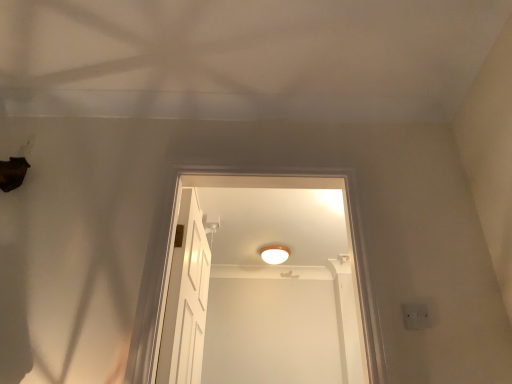
Question: From their relative heights in the image, would you say white wooden door at center is taller or shorter than white matte light fixture at center?

Choices:
 (A) tall
 (B) short

Answer: (A)

Question: Does point (199, 317) appear closer or farther from the camera than point (274, 259)?

Choices:
 (A) closer
 (B) farther

Answer: (A)

Question: From a real-world perspective, relative to white matte light fixture at center, is white wooden door at center vertically above or below?

Choices:
 (A) below
 (B) above

Answer: (A)

Question: Is white matte light fixture at center situated inside white wooden door at center or outside?

Choices:
 (A) inside
 (B) outside

Answer: (B)

Question: Is white matte light fixture at center in front of or behind white wooden door at center in the image?

Choices:
 (A) front
 (B) behind

Answer: (B)

Question: From a real-world perspective, is white matte light fixture at center positioned above or below white wooden door at center?

Choices:
 (A) below
 (B) above

Answer: (B)

Question: Is white matte light fixture at center to the left or to the right of white wooden door at center in the image?

Choices:
 (A) left
 (B) right

Answer: (B)